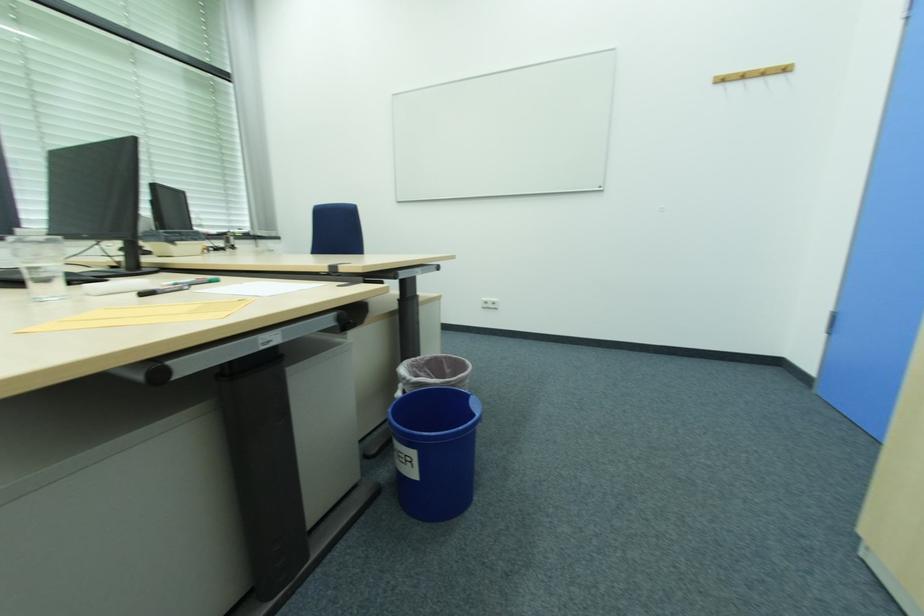
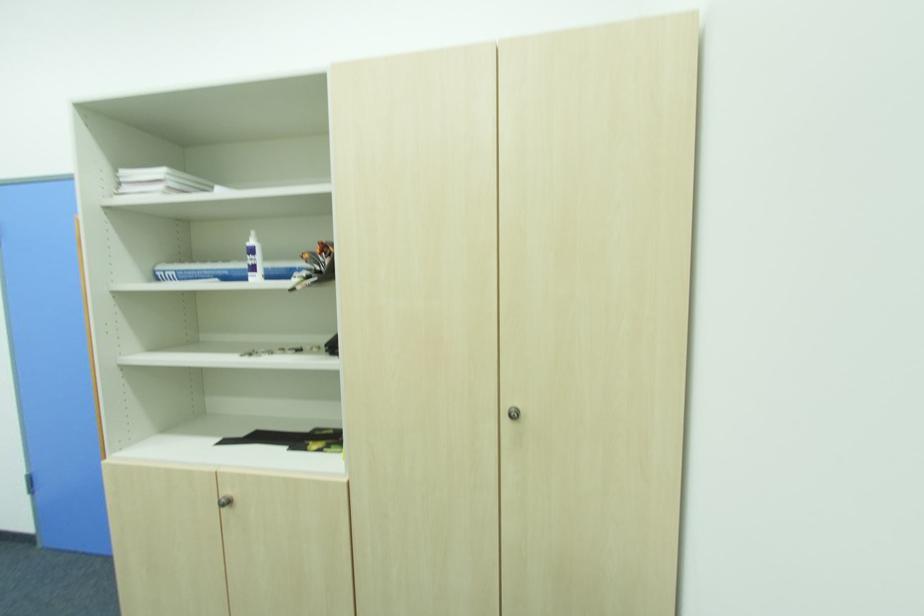
Question: The camera is either moving clockwise (left) or counter-clockwise (right) around the object. The first image is from the beginning of the video and the second image is from the end. Is the camera moving left or right when shooting the video?

Choices:
 (A) Left
 (B) Right

Answer: (A)